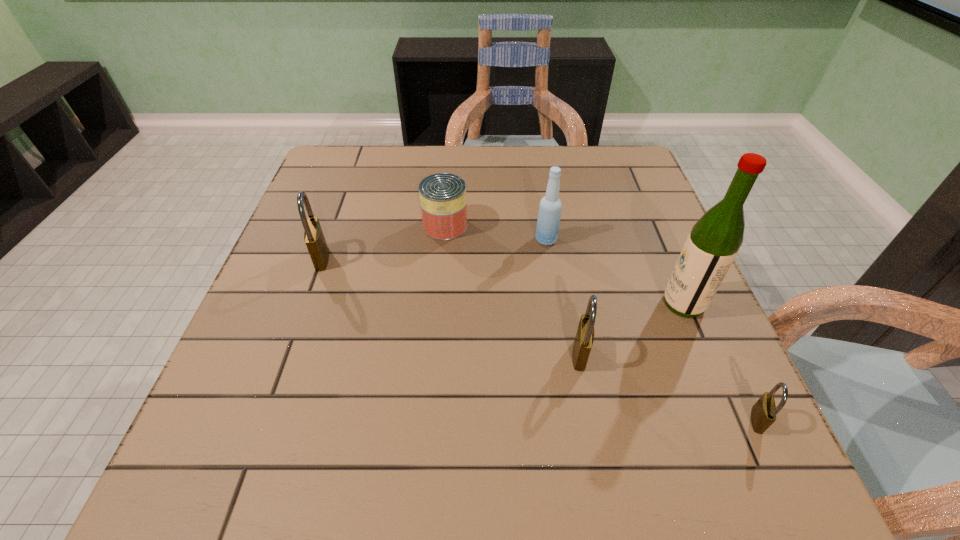
I want to click on vacant space located on the back of the leftmost object, so click(331, 232).

Identify the location of vacant space located 0.150m on the left of the third shortest object. (490, 354).

This screenshot has width=960, height=540. Find the location of `vacant space located 0.250m on the back of the shortest object`. vacant space located 0.250m on the back of the shortest object is located at coordinates (700, 295).

Find the location of a particular element. free region located 0.380m on the front of the bottle is located at coordinates (570, 395).

Image resolution: width=960 pixels, height=540 pixels. I want to click on vacant space located 0.200m on the front of the fifth object from right to left, so click(x=439, y=306).

Locate an element on the screen. The height and width of the screenshot is (540, 960). vacant position located on the label of the liquor is located at coordinates (565, 303).

Locate an element on the screen. The image size is (960, 540). free space located on the label of the liquor is located at coordinates (624, 303).

Locate an element on the screen. vacant area located on the label of the liquor is located at coordinates (610, 303).

This screenshot has width=960, height=540. I want to click on object present at the near edge, so point(763,414).

Identify the location of object that is positioned at the left edge. 314,238.